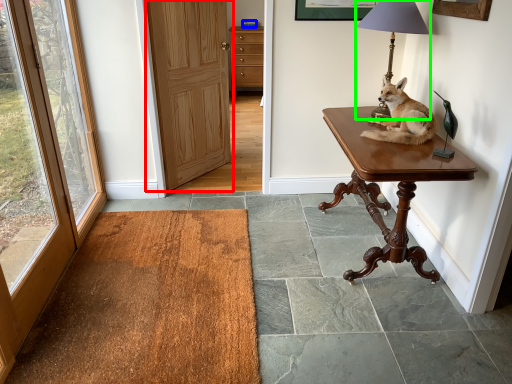
Question: Based on their relative distances, which object is nearer to door (highlighted by a red box)? Choose from corded phone (highlighted by a blue box) and lamp (highlighted by a green box).

Choices:
 (A) corded phone
 (B) lamp

Answer: (B)